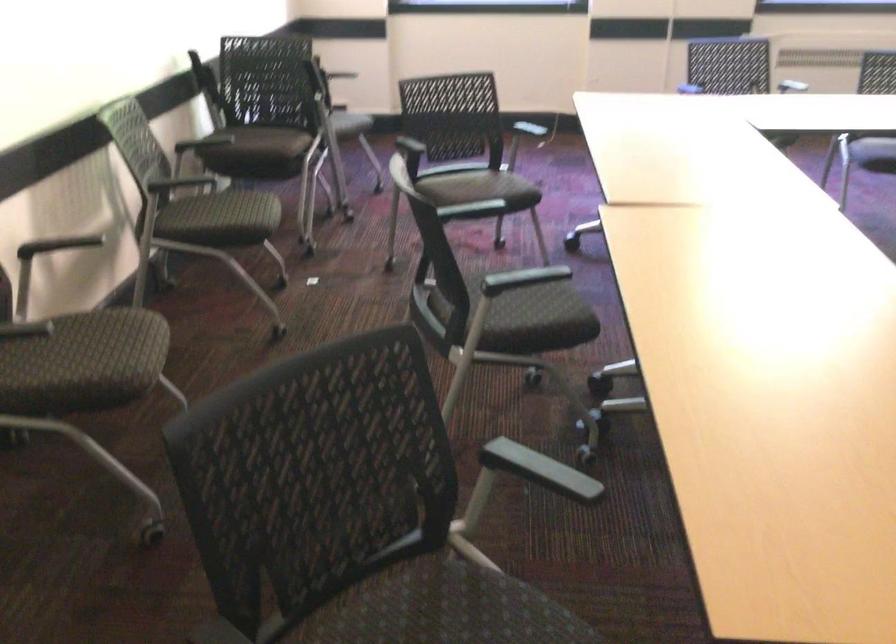
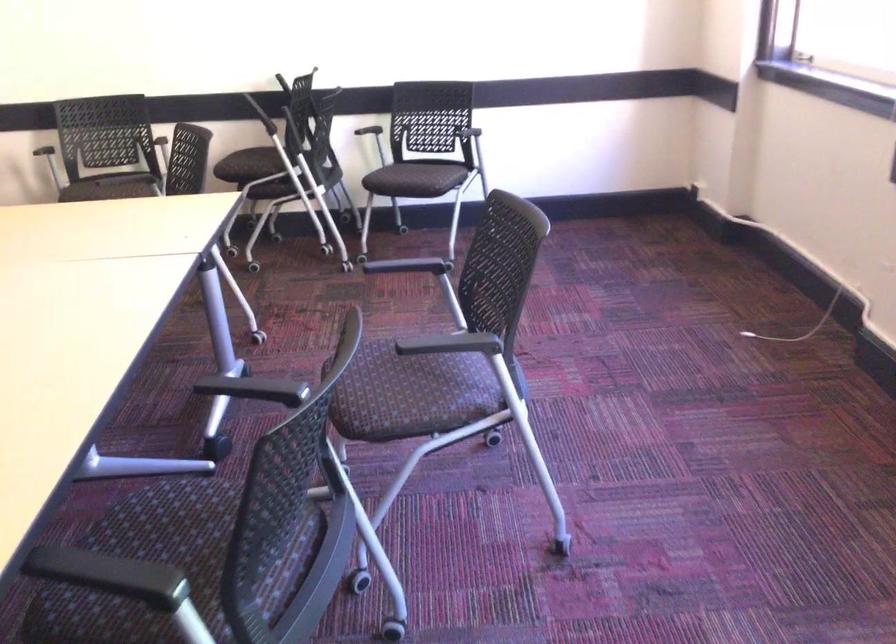
Question: I am providing you with two images of the same scene from different viewpoints. Please identify which objects are invisible in image2.

Choices:
 (A) chair sitting surface
 (B) orange suitcase
 (C) black chair armrest
 (D) white cable

Answer: (A)